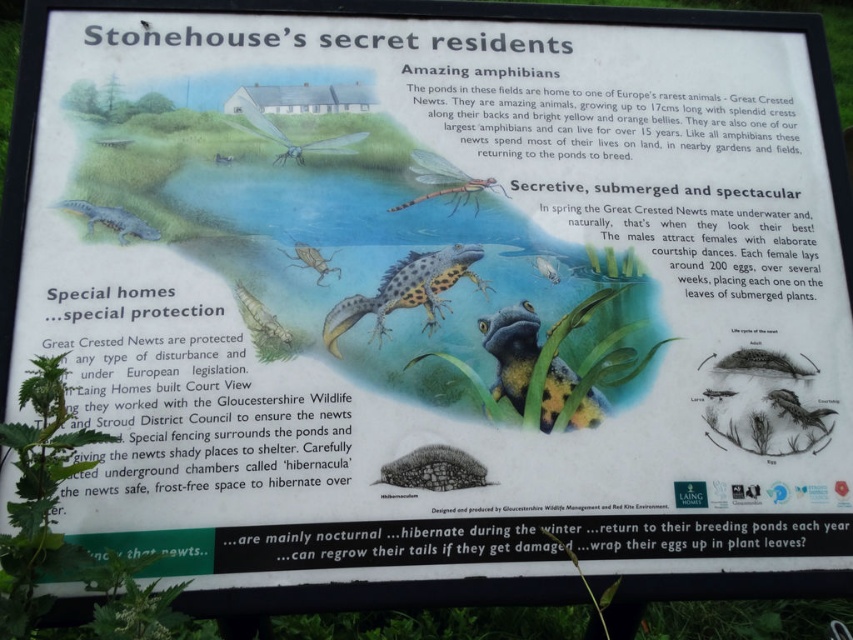
Does brown textured stone at center come behind spotted green frog at lower left?

No.

I want to click on brown textured stone at center, so click(434, 468).

At what (x,y) coordinates should I click in order to perform the action: click on brown textured stone at center. Please return your answer as a coordinate pair (x, y). The width and height of the screenshot is (853, 640). Looking at the image, I should click on (434, 468).

Does spotted skin at center lie behind spotted green frog at lower left?

No, spotted skin at center is closer to the viewer.

Between point (468, 273) and point (154, 236), which one is positioned in front?

Point (154, 236) is in front.

Is point (401, 298) positioned in front of point (109, 224)?

No, it is not.

Where is `spotted skin at center`? The image size is (853, 640). spotted skin at center is located at coordinates (405, 291).

Who is more forward, [283,332] or [329,268]?

Point [283,332] is more forward.

Does translucent greenish fish at center have a lesser height compared to matte brown insect at center?

No.

Which is in front, point (289, 339) or point (296, 250)?

Point (289, 339) is in front.

You are a GUI agent. You are given a task and a screenshot of the screen. Output one action in this format:
    pyautogui.click(x=<x>, y=<y>)
    Task: Click on the translucent greenish fish at center
    The image size is (853, 640).
    Given the screenshot: What is the action you would take?
    260,314